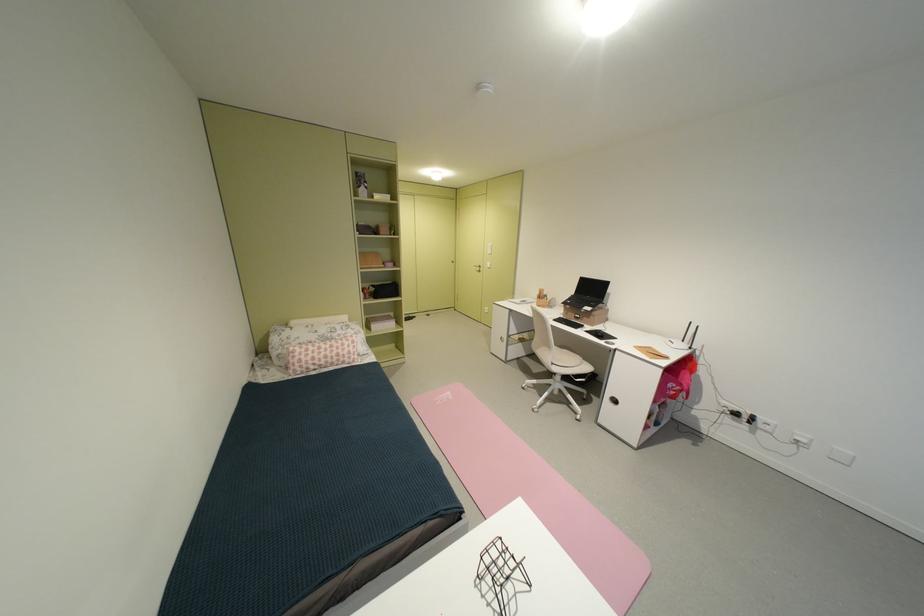
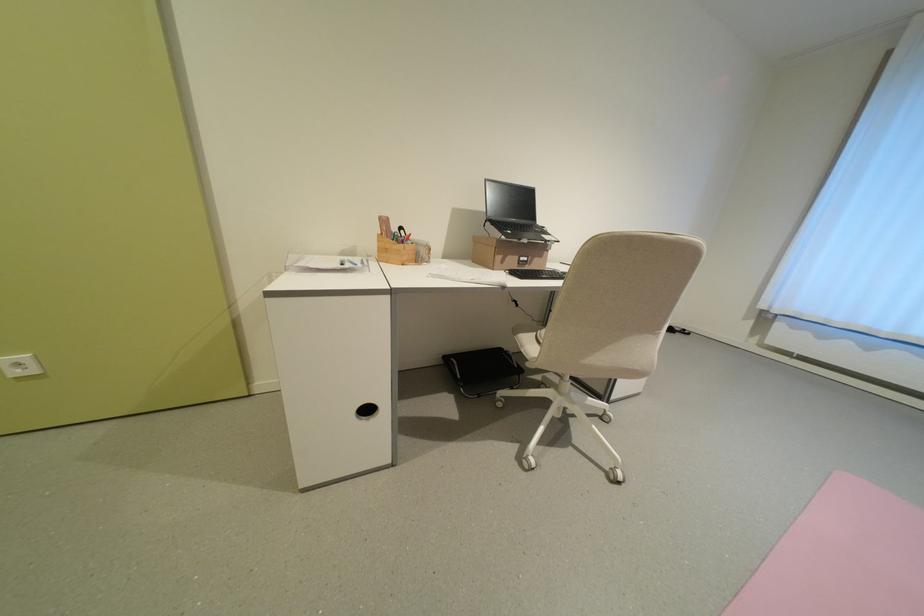
The point at (x=578, y=302) is marked in the first image. Where is the corresponding point in the second image?

(518, 233)